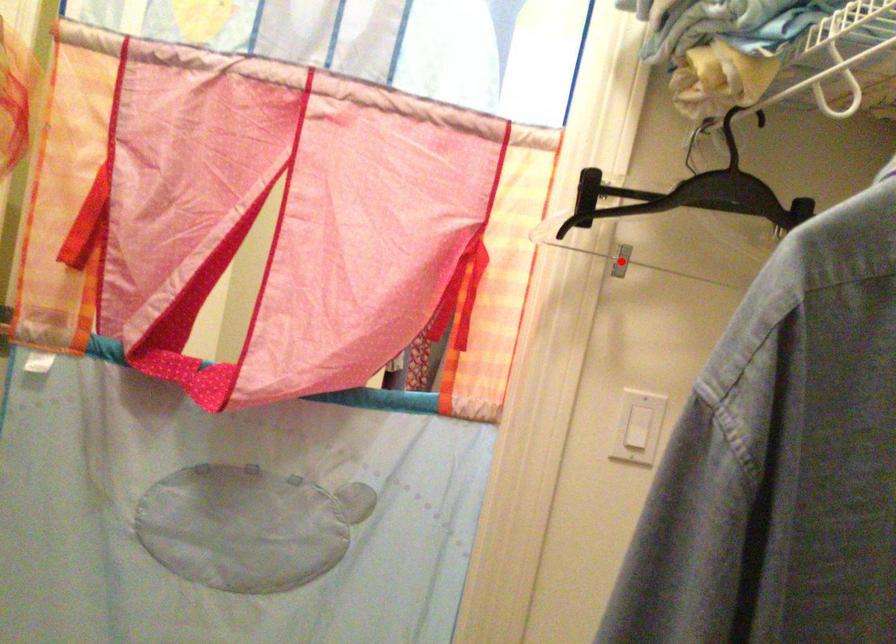
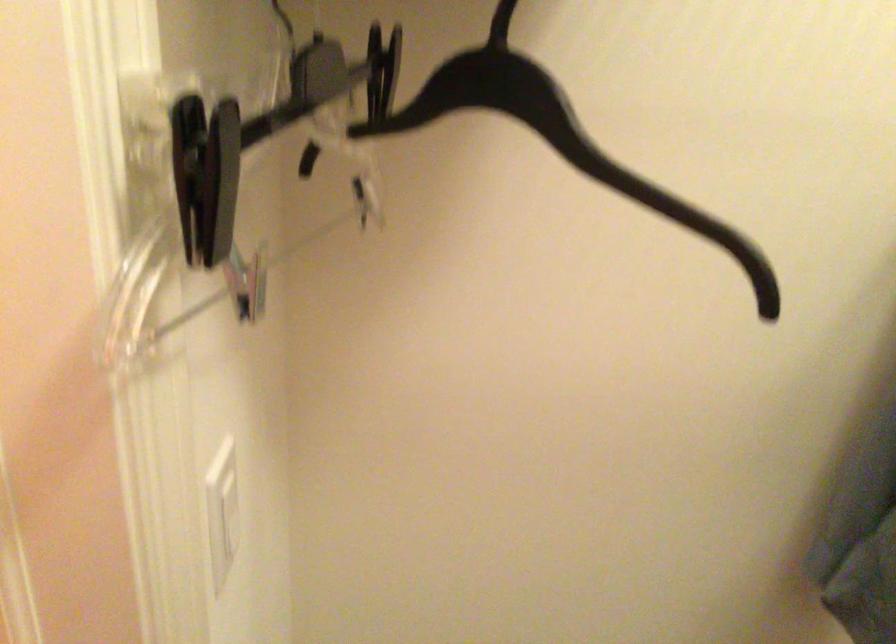
Question: I am providing you with two images of the same scene from different viewpoints. A red point is marked on the first image. Can you still see the location of the red point in image 2?

Choices:
 (A) Yes
 (B) No

Answer: (B)